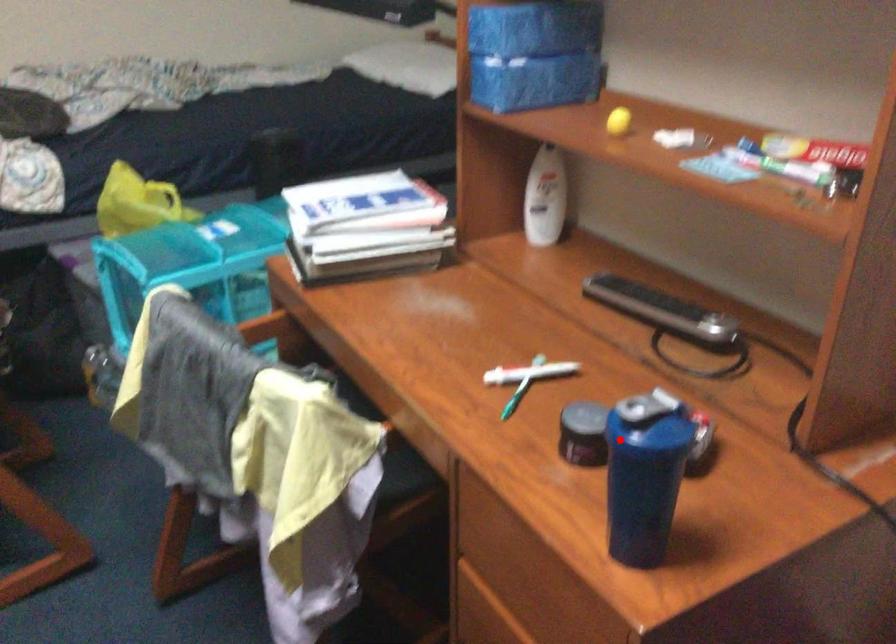
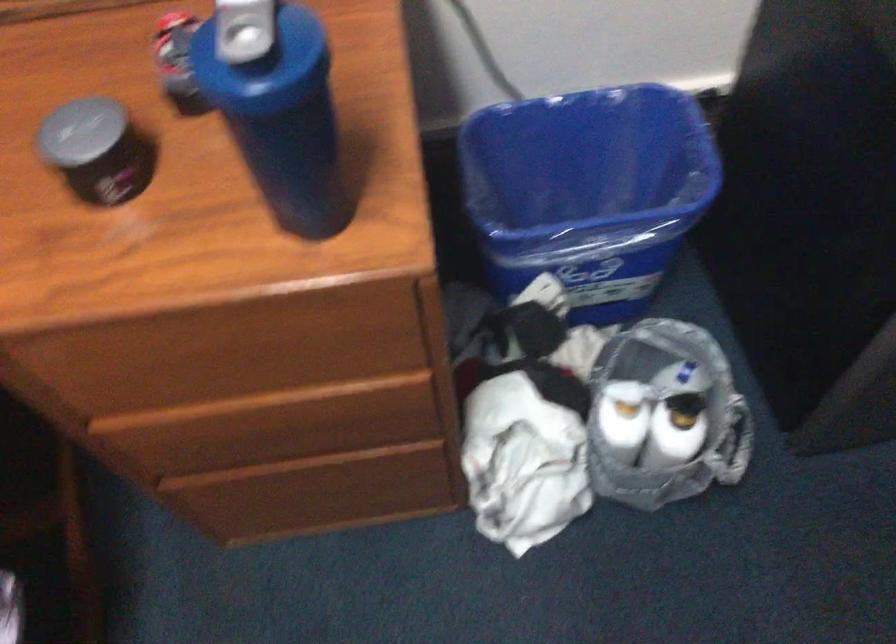
The point at the highlighted location is marked in the first image. Where is the corresponding point in the second image?

(264, 102)